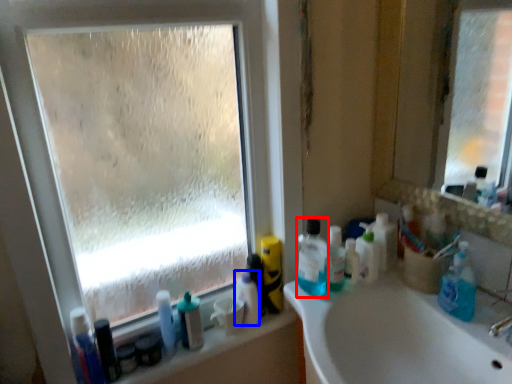
Question: Which object is closer to the camera taking this photo, cleaning product (highlighted by a red box) or toiletry (highlighted by a blue box)?

Choices:
 (A) cleaning product
 (B) toiletry

Answer: (A)